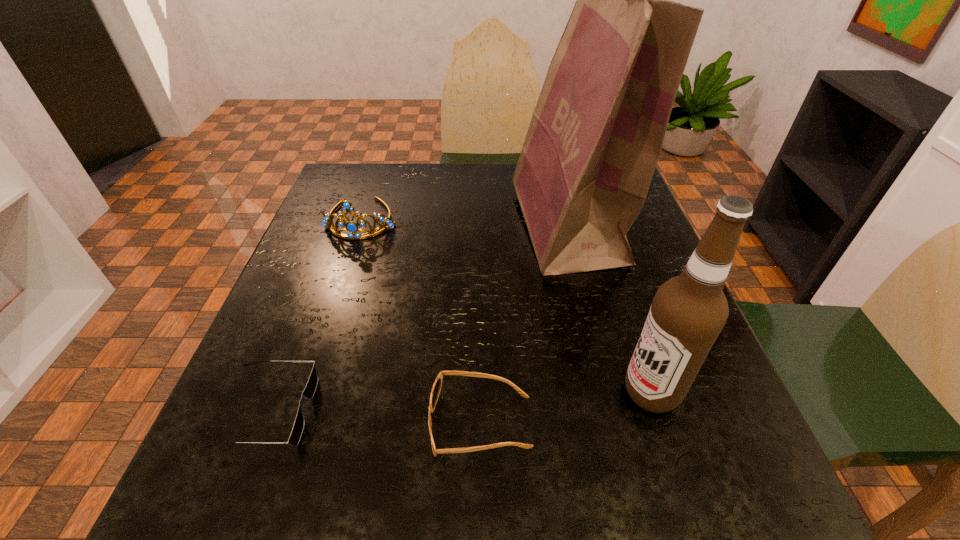
Image resolution: width=960 pixels, height=540 pixels. I want to click on free space at the right edge of the desktop, so click(608, 290).

Identify the location of vacant space at the far left corner. (357, 201).

Where is `vacant space at the near left corner`? vacant space at the near left corner is located at coordinates (241, 486).

At what (x,y) coordinates should I click in order to perform the action: click on vacant space that is in between the third tallest object and the tallest object. Please return your answer as a coordinate pair (x, y). The width and height of the screenshot is (960, 540). Looking at the image, I should click on (465, 223).

Where is `empty location between the tallest object and the third tallest object`? empty location between the tallest object and the third tallest object is located at coordinates (465, 223).

In order to click on unoccupied position between the shortest object and the tiara in this screenshot , I will do `click(316, 315)`.

The width and height of the screenshot is (960, 540). I want to click on empty location between the tiara and the taller sunglasses, so click(421, 321).

I want to click on empty space that is in between the alcohol and the shorter sunglasses, so click(461, 402).

At what (x,y) coordinates should I click in order to perform the action: click on free space that is in between the tallest object and the fourth shortest object. Please return your answer as a coordinate pair (x, y). Looking at the image, I should click on (610, 309).

This screenshot has height=540, width=960. Identify the location of vacant point located between the alcohol and the shorter sunglasses. (461, 402).